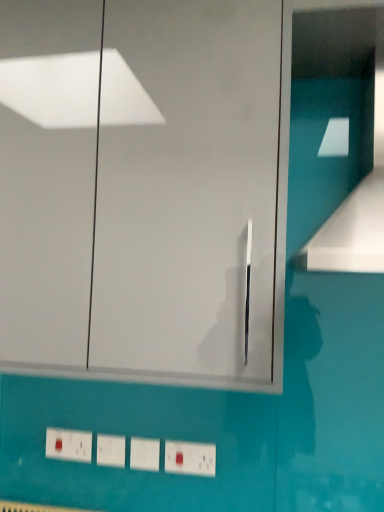
Question: From the image's perspective, is matte white electric outlet at lower left located above or below transparent glass door at center?

Choices:
 (A) below
 (B) above

Answer: (A)

Question: Considering the relative positions of matte white electric outlet at lower left and transparent glass door at center in the image provided, is matte white electric outlet at lower left to the left or to the right of transparent glass door at center?

Choices:
 (A) right
 (B) left

Answer: (B)

Question: Which of these objects is positioned farthest from the matte white electric outlet at lower left?

Choices:
 (A) white plastic light switch at lower center
 (B) white plastic switch at lower center
 (C) transparent glass door at center
 (D) white glossy vent at upper right

Answer: (D)

Question: Which object is the farthest from the white plastic switch at lower center?

Choices:
 (A) transparent glass door at center
 (B) white glossy vent at upper right
 (C) white plastic light switch at lower center
 (D) matte white electric outlet at lower left

Answer: (B)